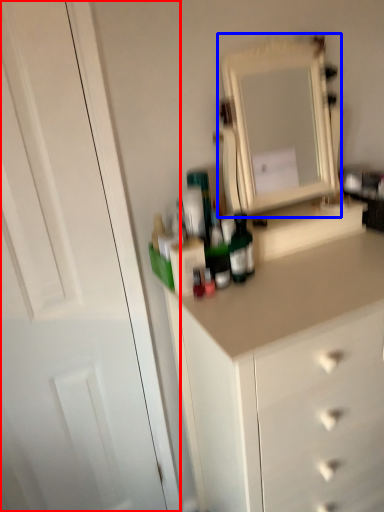
Question: Which of the following is the farthest to the observer, glass door (highlighted by a red box) or medicine cabinet (highlighted by a blue box)?

Choices:
 (A) glass door
 (B) medicine cabinet

Answer: (B)